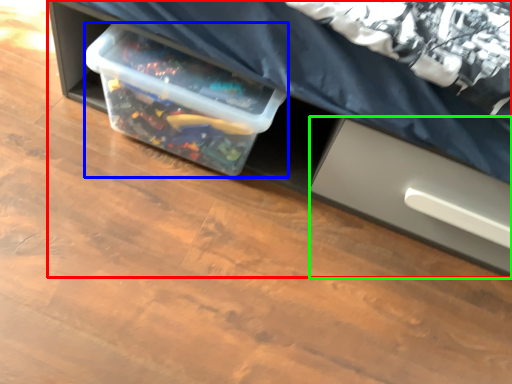
Question: Which object is positioned farthest from furniture (highlighted by a red box)? Select from box (highlighted by a blue box) and drawer (highlighted by a green box).

Choices:
 (A) box
 (B) drawer

Answer: (A)